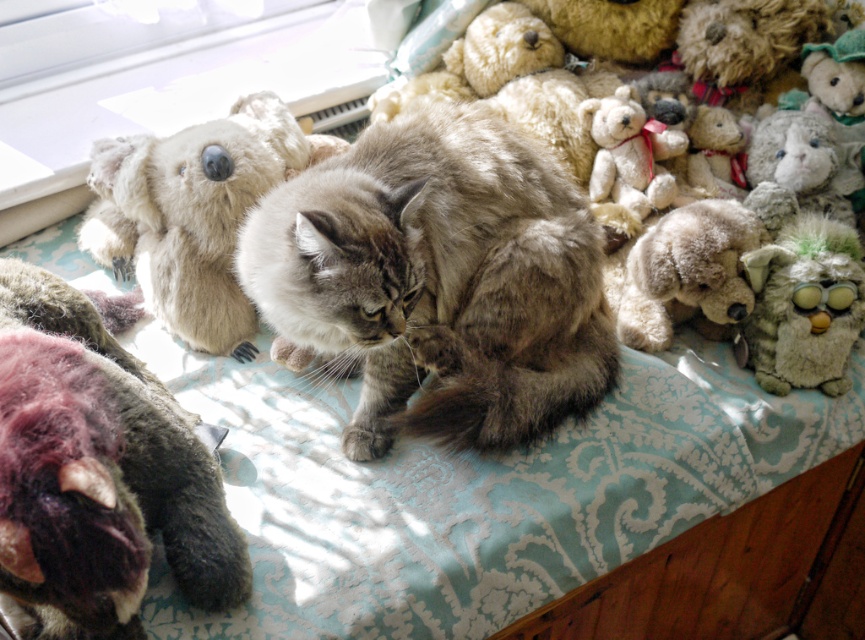
Question: Is fluffy beige teddy bear at upper left positioned in front of white fluffy teddy bear at upper center?

Choices:
 (A) yes
 (B) no

Answer: (A)

Question: Does fluffy beige teddy bear at upper left have a lesser width compared to white fluffy teddy bear at upper center?

Choices:
 (A) yes
 (B) no

Answer: (B)

Question: Among these points, which one is farthest from the camera?

Choices:
 (A) (607, 148)
 (B) (670, 268)

Answer: (A)

Question: Is fuzzy gray cat at center to the left of white fluffy teddy bear at upper center from the viewer's perspective?

Choices:
 (A) yes
 (B) no

Answer: (A)

Question: Which object is positioned closest to the fluffy beige teddy bear at upper left?

Choices:
 (A) green fuzzy owl at right
 (B) fluffy beige stuffed dog at right
 (C) fluffy beige teddy bear at upper right
 (D) fuzzy gray bear at lower left

Answer: (D)

Question: Considering the real-world distances, which object is farthest from the fuzzy gray bear at lower left?

Choices:
 (A) fluffy beige teddy bear at upper left
 (B) white fluffy teddy bear at upper center
 (C) fluffy beige stuffed dog at right

Answer: (B)